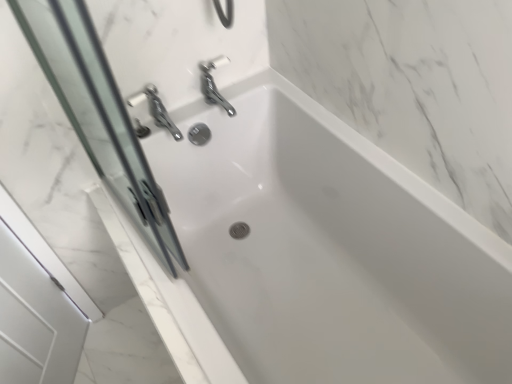
Question: Should I look upward or downward to see white glossy bathtub at center?

Choices:
 (A) up
 (B) down

Answer: (B)

Question: Can white glossy bathtub at center be found inside transparent glass screen door at left?

Choices:
 (A) yes
 (B) no

Answer: (B)

Question: Is transparent glass screen door at left next to white glossy bathtub at center?

Choices:
 (A) no
 (B) yes

Answer: (A)

Question: From the image's perspective, is transparent glass screen door at left on top of white glossy bathtub at center?

Choices:
 (A) no
 (B) yes

Answer: (B)

Question: From a real-world perspective, is transparent glass screen door at left below white glossy bathtub at center?

Choices:
 (A) yes
 (B) no

Answer: (B)

Question: Is transparent glass screen door at left facing towards white glossy bathtub at center?

Choices:
 (A) yes
 (B) no

Answer: (B)

Question: Considering the relative sizes of transparent glass screen door at left and white glossy bathtub at center in the image provided, is transparent glass screen door at left bigger than white glossy bathtub at center?

Choices:
 (A) yes
 (B) no

Answer: (B)

Question: Is white glossy bathtub at center oriented towards transparent glass screen door at left?

Choices:
 (A) yes
 (B) no

Answer: (B)

Question: Is white glossy bathtub at center at the left side of transparent glass screen door at left?

Choices:
 (A) no
 (B) yes

Answer: (A)

Question: Considering the relative sizes of white glossy bathtub at center and transparent glass screen door at left in the image provided, is white glossy bathtub at center bigger than transparent glass screen door at left?

Choices:
 (A) yes
 (B) no

Answer: (A)

Question: Does white glossy bathtub at center have a greater height compared to transparent glass screen door at left?

Choices:
 (A) yes
 (B) no

Answer: (B)

Question: Is white glossy bathtub at center thinner than transparent glass screen door at left?

Choices:
 (A) yes
 (B) no

Answer: (B)

Question: From a real-world perspective, is white glossy bathtub at center over transparent glass screen door at left?

Choices:
 (A) yes
 (B) no

Answer: (B)

Question: Would you say white glossy bathtub at center is inside or outside transparent glass screen door at left?

Choices:
 (A) inside
 (B) outside

Answer: (B)